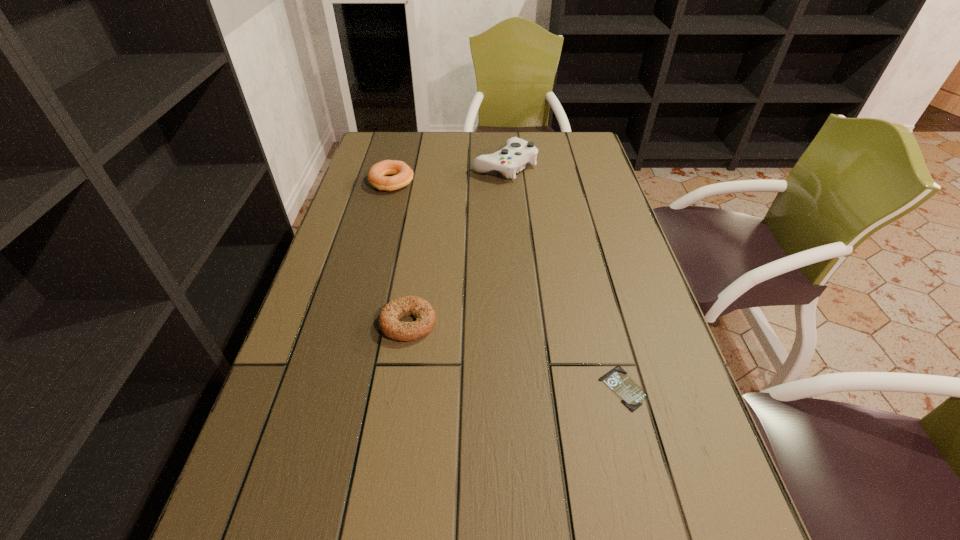
You are a GUI agent. You are given a task and a screenshot of the screen. Output one action in this format:
    pyautogui.click(x=<x>, y=<y>)
    Task: Click on the vacant space located 0.330m on the back of the third tallest object
    
    Given the screenshot: What is the action you would take?
    pyautogui.click(x=424, y=218)

Find the location of a particular element. This screenshot has height=540, width=960. vacant space situated 0.140m on the left of the identity card is located at coordinates (528, 388).

I want to click on object that is at the far edge, so click(x=517, y=152).

At what (x,y) coordinates should I click in order to perform the action: click on object situated at the left edge. Please return your answer as a coordinate pair (x, y). Looking at the image, I should click on (378, 177).

Locate an element on the screen. This screenshot has height=540, width=960. object that is at the right edge is located at coordinates (631, 394).

The image size is (960, 540). I want to click on free space at the far edge of the desktop, so click(x=452, y=163).

This screenshot has width=960, height=540. What are the coordinates of `vacant space at the left edge of the desktop` in the screenshot? It's located at (343, 302).

The image size is (960, 540). I want to click on blank space at the right edge, so click(x=608, y=181).

Where is `vacant space at the far left corner of the desktop`? The width and height of the screenshot is (960, 540). vacant space at the far left corner of the desktop is located at coordinates (389, 143).

Locate an element on the screen. The height and width of the screenshot is (540, 960). free spot between the third farthest object and the farther bagel is located at coordinates (400, 253).